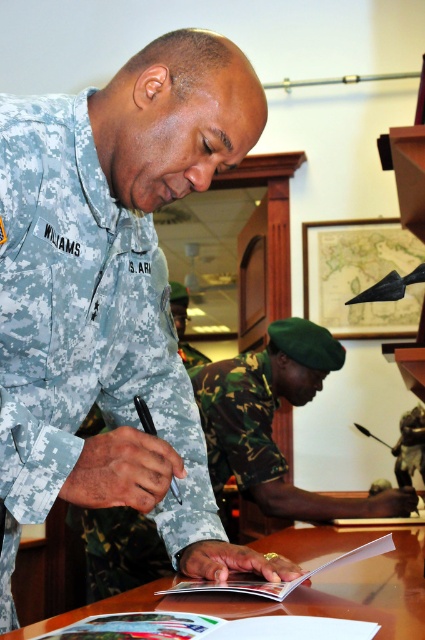
This screenshot has height=640, width=425. What do you see at coordinates (81, 326) in the screenshot?
I see `camouflage fabric uniform at center` at bounding box center [81, 326].

Consider the image. Who is more forward, (130, 284) or (0, 637)?

Point (0, 637) is in front.

Who is more forward, (3,412) or (317,588)?

Positioned in front is point (3,412).

Locate an element on the screen. The height and width of the screenshot is (640, 425). camouflage fabric uniform at center is located at coordinates (81, 326).

Is camouflage uniform at center positioned in front of brown wooden table at center?

No, camouflage uniform at center is behind brown wooden table at center.

Can you confirm if camouflage uniform at center is positioned to the left of brown wooden table at center?

In fact, camouflage uniform at center is to the right of brown wooden table at center.

Who is more distant from viewer, (274, 321) or (326, 577)?

Positioned behind is point (274, 321).

Locate an element on the screen. The image size is (425, 640). camouflage uniform at center is located at coordinates (272, 422).

Does camouflage fabric uniform at center have a greater height compared to camouflage uniform at center?

Correct, camouflage fabric uniform at center is much taller as camouflage uniform at center.

Does camouflage fabric uniform at center have a lesser width compared to camouflage uniform at center?

Yes, camouflage fabric uniform at center is thinner than camouflage uniform at center.

This screenshot has height=640, width=425. I want to click on camouflage fabric uniform at center, so click(x=81, y=326).

Where is `camouflage fabric uniform at center`? Image resolution: width=425 pixels, height=640 pixels. camouflage fabric uniform at center is located at coordinates 81,326.